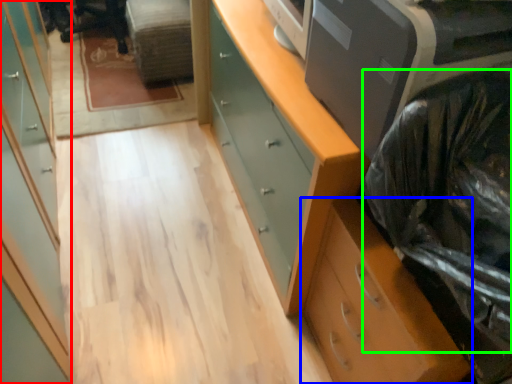
Question: Considering the real-world distances, which object is farthest from cabinetry (highlighted by a red box)? chest of drawers (highlighted by a blue box) or garbage (highlighted by a green box)?

Choices:
 (A) chest of drawers
 (B) garbage

Answer: (B)